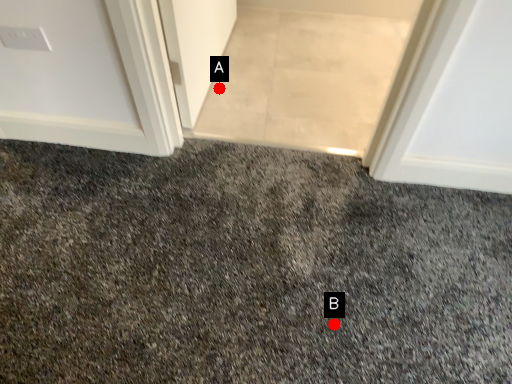
Question: Two points are circled on the image, labeled by A and B beside each circle. Among these points, which one is nearest to the camera?

Choices:
 (A) A is closer
 (B) B is closer

Answer: (B)